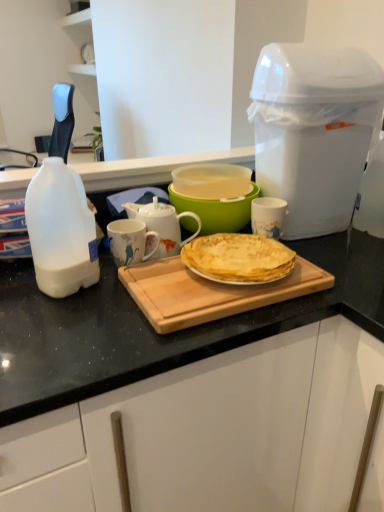
What do you see at coordinates (314, 131) in the screenshot?
I see `white plastic trash can at upper right` at bounding box center [314, 131].

This screenshot has width=384, height=512. Find the location of `white plastic trash can at upper right`. white plastic trash can at upper right is located at coordinates (314, 131).

Locate an element on the screen. The height and width of the screenshot is (512, 384). white glossy mug at center, which is the first mug from right to left is located at coordinates (268, 216).

This screenshot has height=512, width=384. Describe the element at coordinates (162, 225) in the screenshot. I see `white ceramic mug at center` at that location.

Where is `white plastic bottle at left`? This screenshot has height=512, width=384. white plastic bottle at left is located at coordinates (61, 230).

What is the approximate width of yellow crepe at center?

It is 8.91 inches.

You are a GUI agent. You are given a task and a screenshot of the screen. Output one action in this format:
    pyautogui.click(x=<x>, y=<y>)
    Task: Click on the white plastic trash can at upper right
    The width and height of the screenshot is (384, 512).
    Given the screenshot: What is the action you would take?
    pyautogui.click(x=314, y=131)

Are yellow crepe at center and white glossy mug at center, which is the first mug from right to left, located far from each other?

That's not correct — yellow crepe at center is a little close to white glossy mug at center, which is the first mug from right to left.

Is yellow crepe at center outside of white glossy mug at center, which is the first mug from right to left?

Indeed, yellow crepe at center is completely outside white glossy mug at center, which is the first mug from right to left.

Looking at the image, does yellow crepe at center seem bigger or smaller compared to white glossy mug at center, which is the first mug from right to left?

Clearly, yellow crepe at center is larger in size than white glossy mug at center, which is the first mug from right to left.

Between yellow crepe at center and white glossy mug at center, which is the first mug from right to left, which one appears on the left side from the viewer's perspective?

yellow crepe at center.

In the scene shown: Visually, is yellow crepe at center positioned to the left or to the right of white plastic bottle at left?

In the image, yellow crepe at center appears on the right side of white plastic bottle at left.

Is yellow crepe at center beside white plastic bottle at left?

No.

Which object is thinner, yellow crepe at center or white plastic bottle at left?

With smaller width is white plastic bottle at left.

Is yellow crepe at center spatially inside white plastic bottle at left, or outside of it?

yellow crepe at center is located beyond the bounds of white plastic bottle at left.

Considering the positions of point (148, 292) and point (234, 223), is point (148, 292) closer or farther from the camera than point (234, 223)?

Point (148, 292).

The width and height of the screenshot is (384, 512). Identify the location of bowl on the left of wooden cutting board at center. (217, 210).

Between wooden cutting board at center and translucent plastic bowl at center, which one is positioned in front?

wooden cutting board at center is closer to the camera.

Is white ceramic mug at center to the right of wooden cutting board at center from the viewer's perspective?

No, white ceramic mug at center is not to the right of wooden cutting board at center.

How far apart are white ceramic mug at center and wooden cutting board at center?

white ceramic mug at center and wooden cutting board at center are 6.33 inches apart.

Is white ceramic mug at center taller or shorter than wooden cutting board at center?

In the image, white ceramic mug at center appears to be taller than wooden cutting board at center.

Is white ceramic mug at center in contact with wooden cutting board at center?

No, white ceramic mug at center is not in contact with wooden cutting board at center.

From a real-world perspective, relative to wooden cutting board at center, is white plastic trash can at upper right vertically above or below?

Clearly, from a real-world perspective, white plastic trash can at upper right is above wooden cutting board at center.

Looking at this image, considering the sizes of objects white plastic trash can at upper right and wooden cutting board at center in the image provided, who is taller, white plastic trash can at upper right or wooden cutting board at center?

white plastic trash can at upper right.

Locate an element on the screen. The image size is (384, 512). appliance behind the wooden cutting board at center is located at coordinates (314, 131).

Does white plastic trash can at upper right have a greater width compared to wooden cutting board at center?

Yes.

Are white glossy mug at center, which is the first mug from right to left, and wooden cutting board at center located far from each other?

They are positioned close to each other.

Choose the correct answer: Is white glossy mug at center, acting as the 2th mug starting from the left, inside wooden cutting board at center or outside it?

white glossy mug at center, acting as the 2th mug starting from the left, cannot be found inside wooden cutting board at center.

Is wooden cutting board at center at the back of white glossy mug at center, acting as the 2th mug starting from the left?

white glossy mug at center, acting as the 2th mug starting from the left, is not turned away from wooden cutting board at center.

From the image's perspective, between white glossy mug at center, acting as the 2th mug starting from the left, and wooden cutting board at center, which one is located above?

From the image's view, white glossy mug at center, acting as the 2th mug starting from the left, is above.

Are white glossy mug at center, which is the first mug from right to left, and yellow crepe at center far apart?

No.

From a real-world perspective, which object stands above the other?

From a 3D spatial view, white glossy mug at center, which is the first mug from right to left, is above.

Is yellow crepe at center located within white glossy mug at center, which is the first mug from right to left?

No, yellow crepe at center is not surrounded by white glossy mug at center, which is the first mug from right to left.

Where is `mug that is the 2nd one when counting backward from the yellow crepe at center`? mug that is the 2nd one when counting backward from the yellow crepe at center is located at coordinates (268, 216).

Identify the location of dessert below the white plastic bottle at left (from the image's perspective). (238, 258).

Which object lies nearer to the anchor point translucent plastic bowl at center, wooden cutting board at center or white ceramic mug at center, arranged as the 1th mug when viewed from the left?

white ceramic mug at center, arranged as the 1th mug when viewed from the left.

Looking at the image, which one is located further to white ceramic mug at center, white ceramic mug at center, positioned as the 2th mug in right-to-left order, or yellow crepe at center?

The object further to white ceramic mug at center is yellow crepe at center.

When comparing their distances from white ceramic mug at center, does translucent plastic bowl at center or yellow crepe at center seem closer?

translucent plastic bowl at center is positioned closer to the anchor white ceramic mug at center.

From the picture: Estimate the real-world distances between objects in this image. Which object is further from yellow crepe at center, translucent plastic bowl at center or white glossy mug at center, acting as the 2th mug starting from the left?

translucent plastic bowl at center lies further to yellow crepe at center than the other object.

Which object lies further to the anchor point white glossy mug at center, acting as the 2th mug starting from the left, white ceramic mug at center or white ceramic mug at center, arranged as the 1th mug when viewed from the left?

Based on the image, white ceramic mug at center, arranged as the 1th mug when viewed from the left, appears to be further to white glossy mug at center, acting as the 2th mug starting from the left.

From the image, which object appears to be farther from white ceramic mug at center, yellow crepe at center or white plastic trash can at upper right?

white plastic trash can at upper right lies further to white ceramic mug at center than the other object.

Looking at the image, which one is located further to white ceramic mug at center, arranged as the 1th mug when viewed from the left, yellow crepe at center or wooden cutting board at center?

yellow crepe at center is positioned further to the anchor white ceramic mug at center, arranged as the 1th mug when viewed from the left.

When comparing their distances from white plastic bottle at left, does white ceramic mug at center or translucent plastic bowl at center seem closer?

white ceramic mug at center.

Identify the location of cutting board located between white ceramic mug at center and white plastic trash can at upper right in the left-right direction. (209, 292).

Locate an element on the screen. This screenshot has width=384, height=512. cutting board situated between white ceramic mug at center, arranged as the 1th mug when viewed from the left, and white plastic trash can at upper right from left to right is located at coordinates (209, 292).

The width and height of the screenshot is (384, 512). I want to click on bowl located between white plastic bottle at left and white plastic trash can at upper right in the left-right direction, so click(217, 210).

At what (x,y) coordinates should I click in order to perform the action: click on mug located between white ceramic mug at center and white plastic trash can at upper right in the left-right direction. Please return your answer as a coordinate pair (x, y). Image resolution: width=384 pixels, height=512 pixels. Looking at the image, I should click on (268, 216).